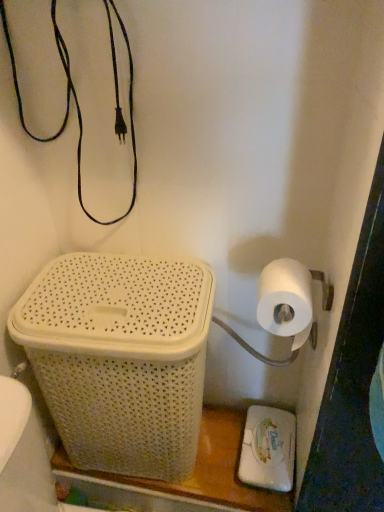
Question: Can you confirm if white matte toilet paper at right is positioned to the right of white wicker basket at lower left?

Choices:
 (A) no
 (B) yes

Answer: (B)

Question: Does white matte toilet paper at right turn towards white wicker basket at lower left?

Choices:
 (A) yes
 (B) no

Answer: (B)

Question: From the image's perspective, is white matte toilet paper at right located beneath white wicker basket at lower left?

Choices:
 (A) no
 (B) yes

Answer: (A)

Question: Considering the relative sizes of white matte toilet paper at right and white wicker basket at lower left in the image provided, is white matte toilet paper at right wider than white wicker basket at lower left?

Choices:
 (A) no
 (B) yes

Answer: (A)

Question: Is the position of white matte toilet paper at right more distant than that of white wicker basket at lower left?

Choices:
 (A) yes
 (B) no

Answer: (B)

Question: From their relative heights in the image, would you say white wicker basket at lower left is taller or shorter than white matte toilet paper at right?

Choices:
 (A) tall
 (B) short

Answer: (A)

Question: Looking at their shapes, would you say white wicker basket at lower left is wider or thinner than white matte toilet paper at right?

Choices:
 (A) thin
 (B) wide

Answer: (B)

Question: From the image's perspective, is white wicker basket at lower left located above or below white matte toilet paper at right?

Choices:
 (A) below
 (B) above

Answer: (A)

Question: From a real-world perspective, is white wicker basket at lower left positioned above or below white matte toilet paper at right?

Choices:
 (A) above
 (B) below

Answer: (B)

Question: Is white wicker basket at lower left taller or shorter than white matte toilet paper at right?

Choices:
 (A) short
 (B) tall

Answer: (B)

Question: Relative to white matte toilet paper at right, is white wicker basket at lower left in front or behind?

Choices:
 (A) behind
 (B) front

Answer: (A)

Question: Considering the positions of white wicker basket at lower left and white matte toilet paper at right in the image, is white wicker basket at lower left wider or thinner than white matte toilet paper at right?

Choices:
 (A) thin
 (B) wide

Answer: (B)

Question: Do you think white wicker basket at lower left is within white matte toilet paper at right, or outside of it?

Choices:
 (A) outside
 (B) inside

Answer: (A)

Question: Is white matte toilet paper at right inside the boundaries of white wicker basket at lower left, or outside?

Choices:
 (A) inside
 (B) outside

Answer: (B)

Question: Considering the relative positions of white matte toilet paper at right and white wicker basket at lower left in the image provided, is white matte toilet paper at right to the left or to the right of white wicker basket at lower left?

Choices:
 (A) left
 (B) right

Answer: (B)